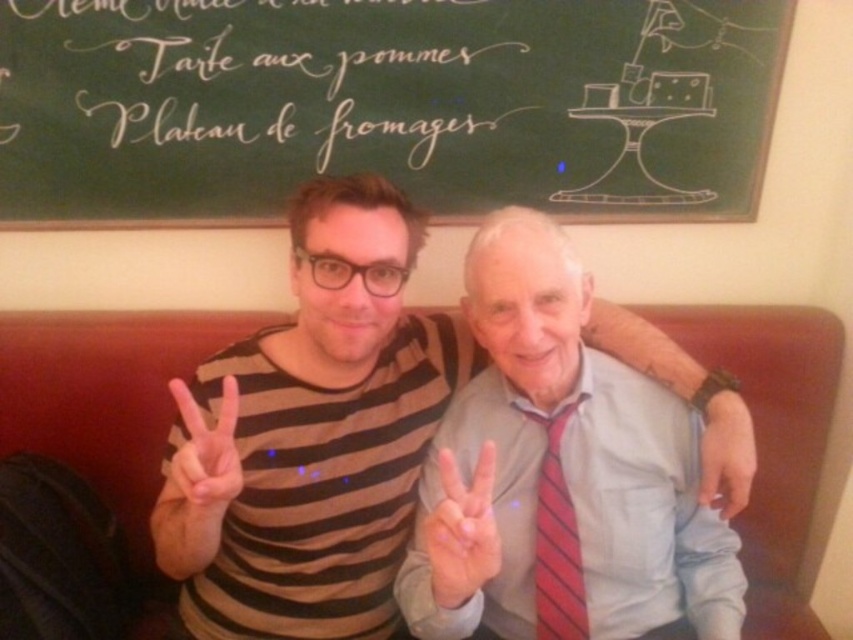
You are a photographer adjusting the lighting in the scene. You want to ensure that the white matte hand at center and the red striped tie at center are both clearly visible. Which object should you focus on first to adjust the lighting so that both are properly illuminated?

The white matte hand at center is in front of the red striped tie at center, so you should focus on adjusting the lighting for the white matte hand at center first to ensure it doesn not block the light reaching the red striped tie at center.